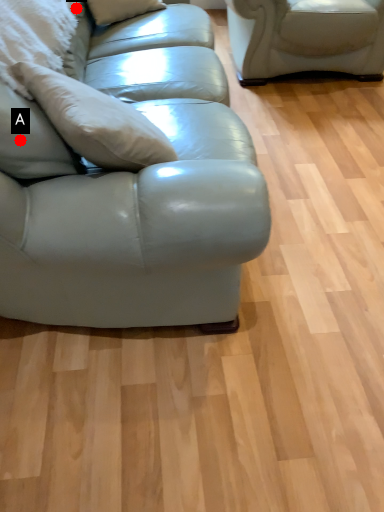
Question: Two points are circled on the image, labeled by A and B beside each circle. Among these points, which one is nearest to the camera?

Choices:
 (A) A is closer
 (B) B is closer

Answer: (A)